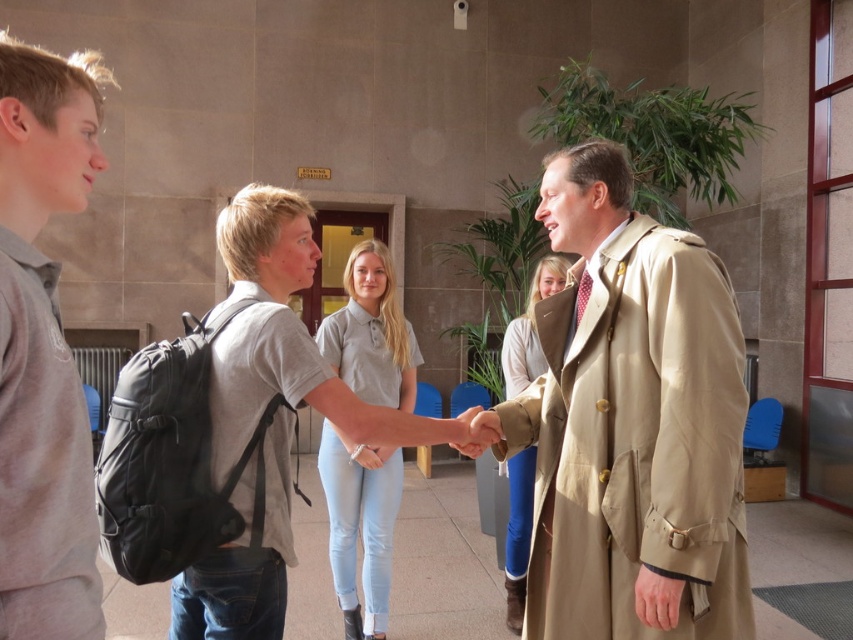
You are a photographer standing at the door with the yellow sign. You want to take a photo of the tan leather trench coat at center and the black backpack on the left. Can you fit both in your camera frame if your camera has a 6 feet width field of view?

The distance between the tan leather trench coat at center and the black backpack on the left is 5.11 feet. Since the camera has a 6 feet width field of view, both objects can be captured within the frame.